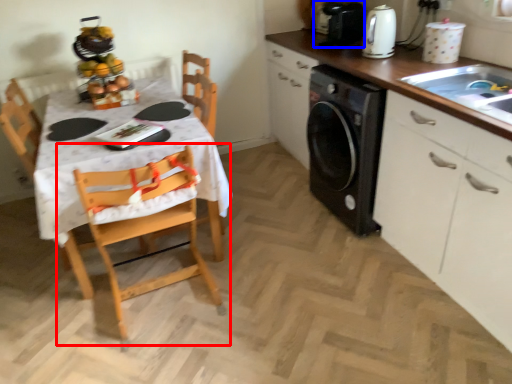
Question: Which point is closer to the camera, chair (highlighted by a red box) or appliance (highlighted by a blue box)?

Choices:
 (A) chair
 (B) appliance

Answer: (A)